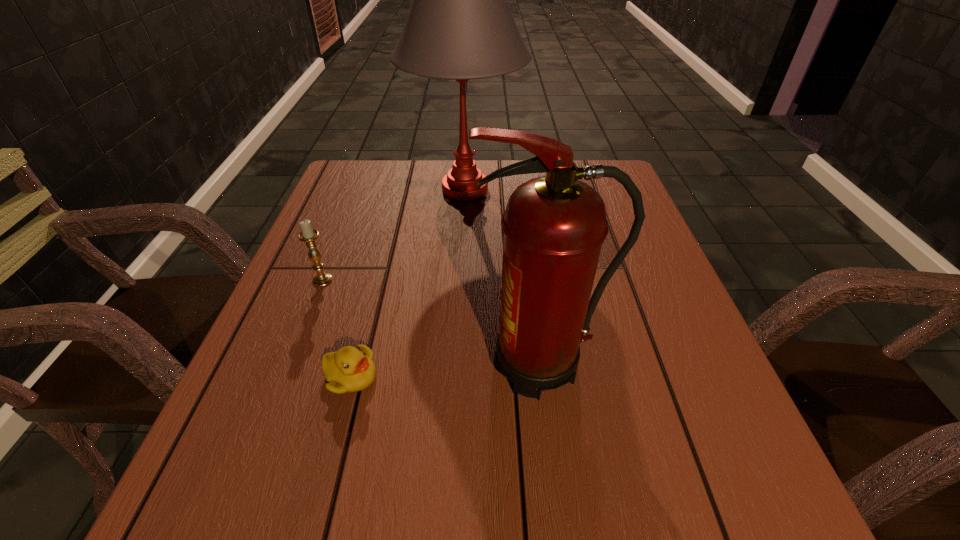
In order to click on the tallest object in this screenshot , I will do `click(459, 27)`.

The image size is (960, 540). Find the location of `table lamp`. table lamp is located at coordinates (459, 27).

Locate an element on the screen. fire extinguisher is located at coordinates pos(554,226).

Locate an element on the screen. This screenshot has width=960, height=540. the leftmost object is located at coordinates (308, 235).

Where is `the third nearest object`? The image size is (960, 540). the third nearest object is located at coordinates (308, 235).

Identify the location of duckling. (350, 369).

The image size is (960, 540). Find the location of `free point located on the front-facing side of the farthest object`. free point located on the front-facing side of the farthest object is located at coordinates (621, 190).

Locate an element on the screen. vacant area located 0.120m on the front-facing side of the second tallest object is located at coordinates (404, 364).

This screenshot has height=540, width=960. Find the location of `vacant space located on the front-facing side of the second tallest object`. vacant space located on the front-facing side of the second tallest object is located at coordinates (279, 364).

This screenshot has width=960, height=540. I want to click on free location located 0.290m on the front-facing side of the second tallest object, so coord(308,364).